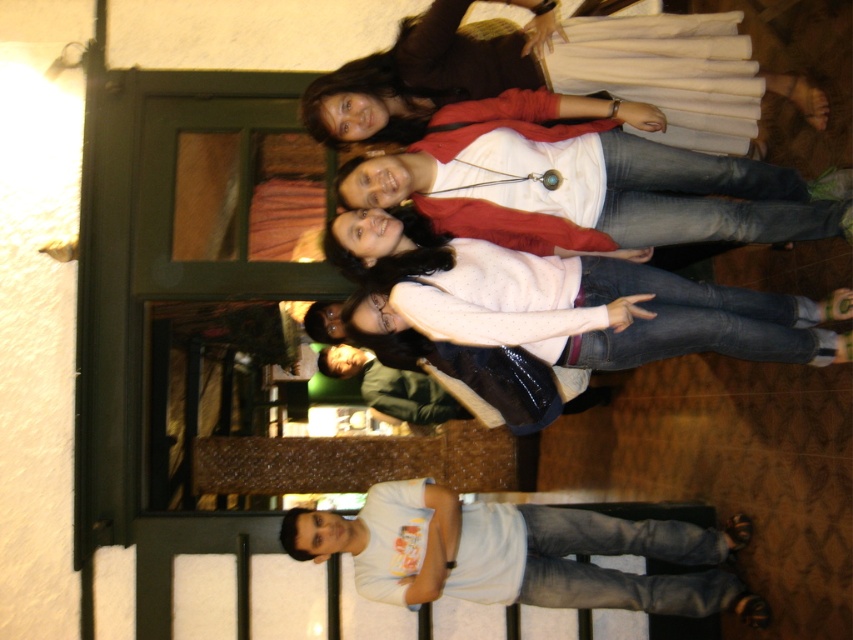
Question: Which point is farther to the camera?

Choices:
 (A) matte brown jacket at upper center
 (B) white matte sweater at center
 (C) white matte t-shirt at lower center
 (D) white matte shirt at center

Answer: (C)

Question: Which of these objects is positioned closest to the white matte sweater at center?

Choices:
 (A) white matte shirt at center
 (B) matte brown jacket at upper center

Answer: (A)

Question: Is matte brown jacket at upper center closer to camera compared to white matte shirt at center?

Choices:
 (A) yes
 (B) no

Answer: (B)

Question: Which point is farther to the camera?

Choices:
 (A) matte brown jacket at upper center
 (B) white matte shirt at center
 (C) white matte t-shirt at lower center

Answer: (C)

Question: Does matte brown jacket at upper center lie behind white matte t-shirt at lower center?

Choices:
 (A) no
 (B) yes

Answer: (A)

Question: In this image, where is white matte shirt at center located relative to white matte t-shirt at lower center?

Choices:
 (A) left
 (B) right

Answer: (B)